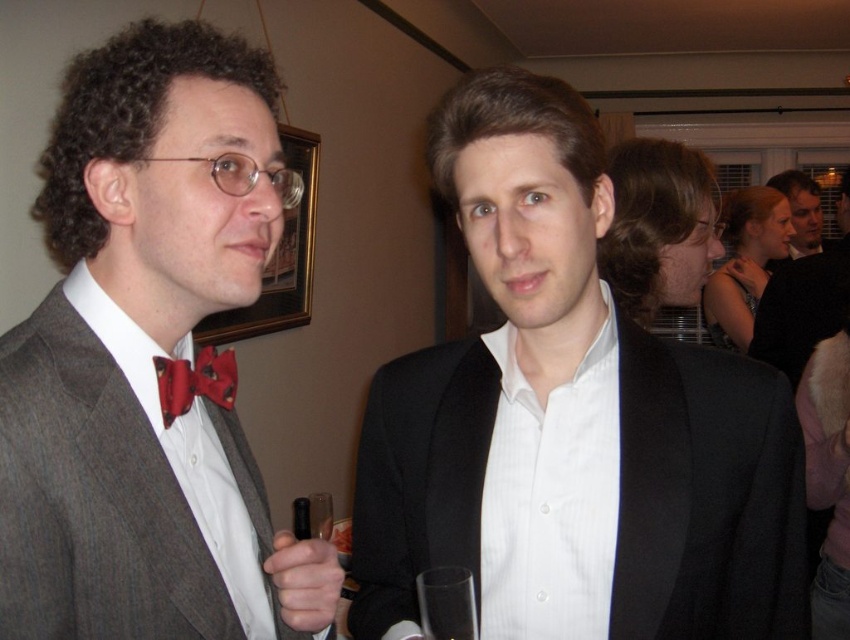
Is matte gray suit at left above white shirt at center?

Actually, matte gray suit at left is below white shirt at center.

Measure the distance between matte gray suit at left and camera.

matte gray suit at left and camera are 22.60 inches apart.

Locate an element on the screen. matte gray suit at left is located at coordinates (146, 358).

Can you confirm if matte gray suit at left is shorter than matte black suit at upper center?

In fact, matte gray suit at left may be taller than matte black suit at upper center.

Does point (78, 512) come in front of point (799, 220)?

Yes, it is in front of point (799, 220).

Is point (7, 561) positioned after point (816, 209)?

That is False.

This screenshot has height=640, width=850. I want to click on matte gray suit at left, so click(x=146, y=358).

Between point (820, 282) and point (437, 598), which one is positioned in front?

Point (437, 598) is more forward.

Is white shirt at center above transparent glass at center?

Yes, white shirt at center is above transparent glass at center.

Is point (824, 280) farther from viewer compared to point (450, 595)?

Yes, it is.

I want to click on white shirt at center, so click(x=803, y=300).